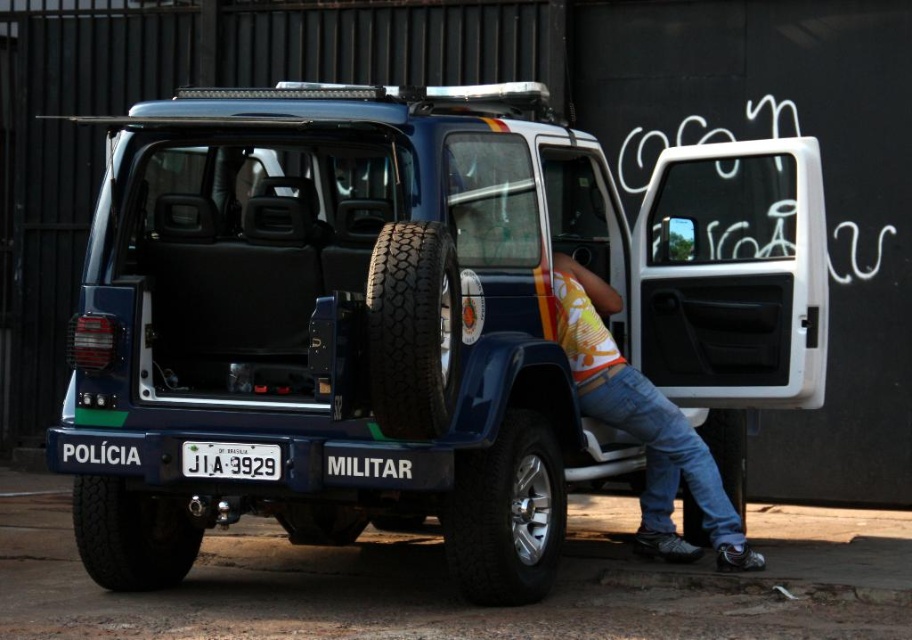
Question: Does blue matte/soft plastic jeep at center appear over black rubber tire at lower right?

Choices:
 (A) yes
 (B) no

Answer: (A)

Question: Among these objects, which one is farthest from the camera?

Choices:
 (A) black rubber tire at lower left
 (B) white plastic license plate at center
 (C) shiny metallic tire at lower center

Answer: (A)

Question: Which object is positioned farthest from the black rubber tire at lower right?

Choices:
 (A) denim jeans at lower right
 (B) blue matte/soft plastic jeep at center
 (C) black rubber tire at lower left
 (D) white plastic license plate at center

Answer: (C)

Question: Can you confirm if black rubber tire at center is positioned to the left of black rubber tire at lower right?

Choices:
 (A) yes
 (B) no

Answer: (A)

Question: Does denim jeans at lower right have a larger size compared to black rubber tire at center?

Choices:
 (A) no
 (B) yes

Answer: (B)

Question: Among these points, which one is nearest to the camera?

Choices:
 (A) (247, 477)
 (B) (169, 496)
 (C) (643, 403)

Answer: (A)